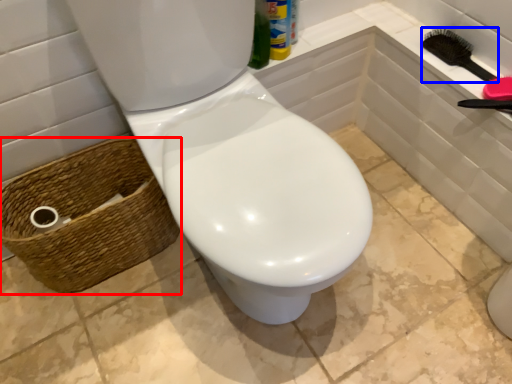
Question: Which object is further to the camera taking this photo, basket (highlighted by a red box) or brush (highlighted by a blue box)?

Choices:
 (A) basket
 (B) brush

Answer: (B)